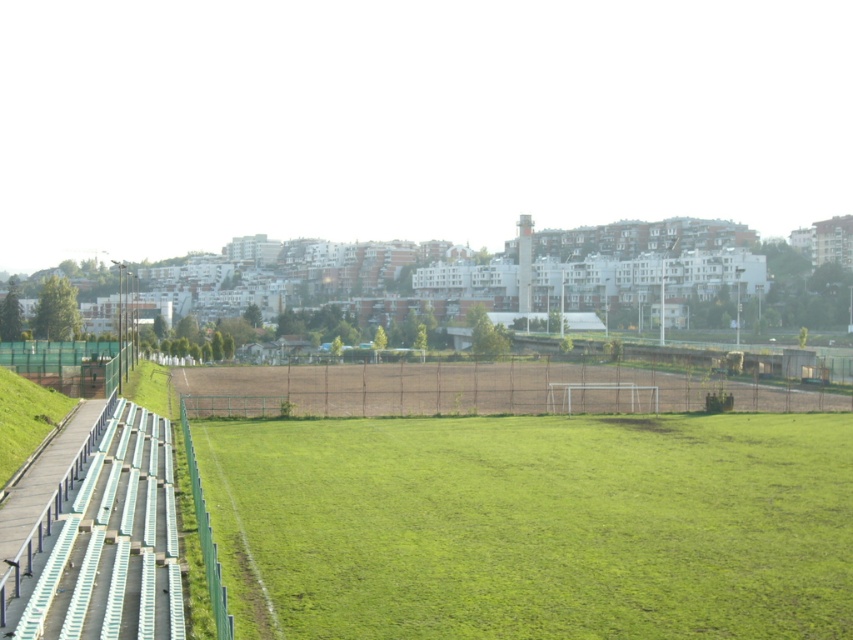
You are standing at the point marked by the coordinates [534,525] on the soccer pitch. Looking around, you see the green grass field at center and the white goalpost at one end. Which direction should you walk to reach the goalpost?

A: The point marked by the coordinates [534,525] is located at the green grass field at center. Since the white goalpost is at one end of the field, you should walk towards the end where the goalpost is positioned to reach it.

Based on the coordinates provided in the description, where is the green grass field at center located?

The green grass field at center is located at point coordinates of (534,525).

You are standing at the edge of the soccer field and want to walk to both points marked on the field. Which point, point (758,570) or point (761,394), will you reach first if you walk straight ahead?

Point (758,570) is closer to the viewer, so you will reach point (758,570) first.